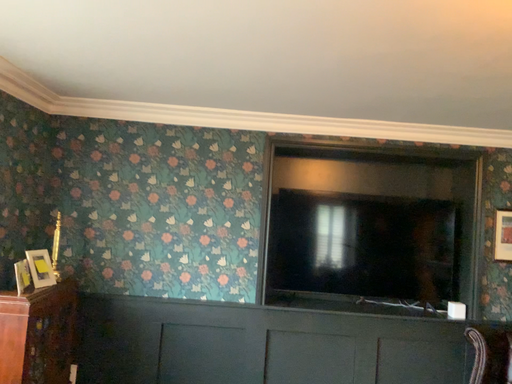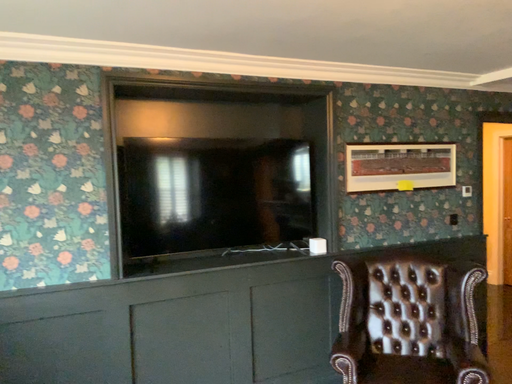
Question: Which way did the camera rotate in the video?

Choices:
 (A) rotated left
 (B) rotated right

Answer: (B)